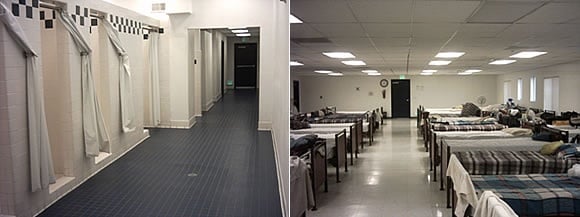
Image resolution: width=580 pixels, height=217 pixels. I want to click on doorway, so click(239, 43).